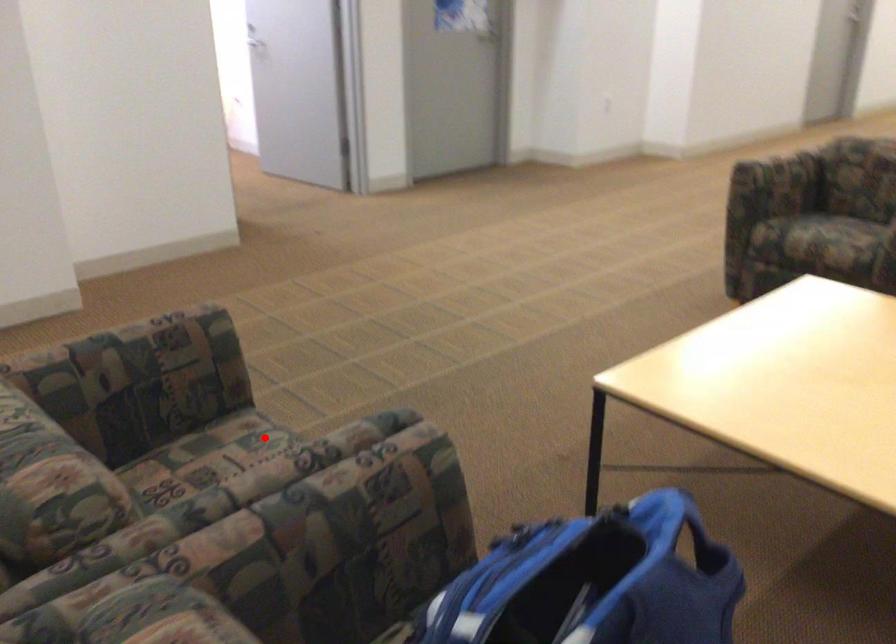
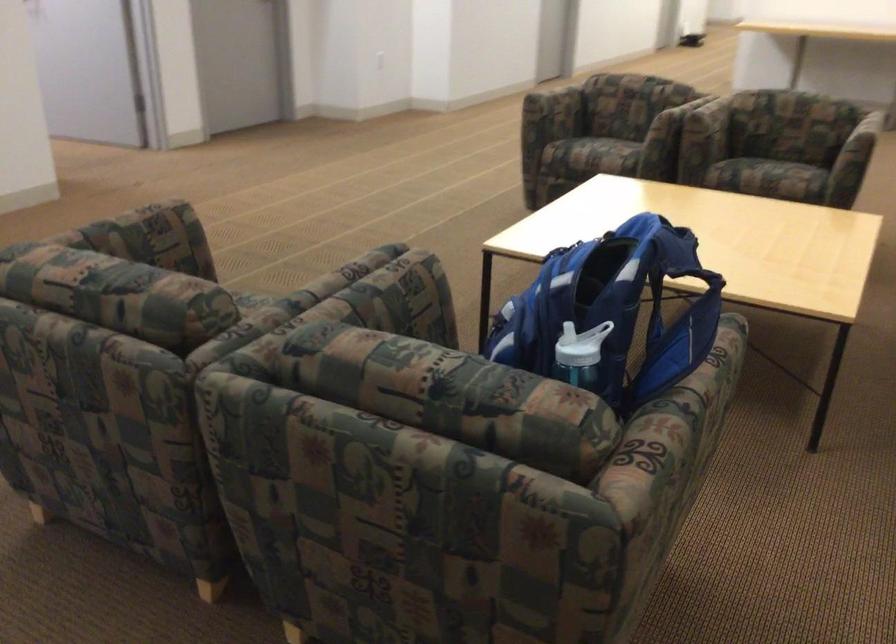
Find the pixel in the second image that matches the highlighted location in the first image.

(250, 298)